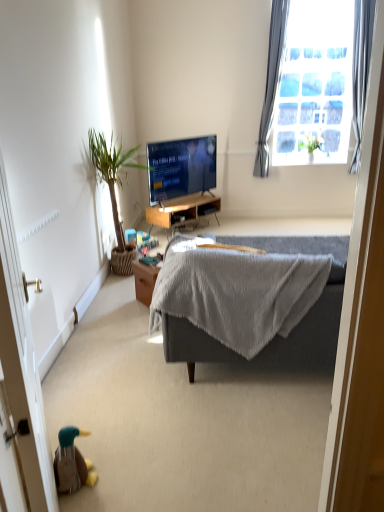
Question: Is wooden desk at center next to green leafy plant at left, placed as the first houseplant when sorted from front to back, and touching it?

Choices:
 (A) no
 (B) yes

Answer: (A)

Question: Can we say wooden desk at center lies outside green leafy plant at left, which is the 2th houseplant from top to bottom?

Choices:
 (A) no
 (B) yes

Answer: (B)

Question: Considering the relative sizes of wooden desk at center and green leafy plant at left, placed as the first houseplant when sorted from front to back, in the image provided, is wooden desk at center thinner than green leafy plant at left, placed as the first houseplant when sorted from front to back,?

Choices:
 (A) yes
 (B) no

Answer: (A)

Question: Does wooden desk at center have a lesser height compared to green leafy plant at left, the 1th houseplant viewed from the left?

Choices:
 (A) yes
 (B) no

Answer: (A)

Question: Considering the relative sizes of wooden desk at center and green leafy plant at left, arranged as the second houseplant when viewed from the back, in the image provided, is wooden desk at center bigger than green leafy plant at left, arranged as the second houseplant when viewed from the back,?

Choices:
 (A) yes
 (B) no

Answer: (B)

Question: From a real-world perspective, is wooden desk at center physically located above or below green leafy plant at left, arranged as the second houseplant when viewed from the back?

Choices:
 (A) above
 (B) below

Answer: (B)

Question: From their relative heights in the image, would you say wooden desk at center is taller or shorter than green leafy plant at left, the 1th houseplant viewed from the left?

Choices:
 (A) tall
 (B) short

Answer: (B)

Question: Looking at the image, does wooden desk at center seem bigger or smaller compared to green leafy plant at left, arranged as the second houseplant when viewed from the back?

Choices:
 (A) small
 (B) big

Answer: (A)

Question: Based on their positions, is wooden desk at center located to the left or right of green leafy plant at left, arranged as the second houseplant when viewed from the back?

Choices:
 (A) left
 (B) right

Answer: (B)

Question: From the image's perspective, is green leafy plant at upper right, which is the second houseplant from front to back, positioned above or below brown wooden screen door at lower left?

Choices:
 (A) above
 (B) below

Answer: (A)

Question: In terms of width, does green leafy plant at upper right, positioned as the 1th houseplant in top-to-bottom order, look wider or thinner when compared to brown wooden screen door at lower left?

Choices:
 (A) wide
 (B) thin

Answer: (A)

Question: Relative to brown wooden screen door at lower left, is green leafy plant at upper right, positioned as the 2th houseplant in left-to-right order, in front or behind?

Choices:
 (A) front
 (B) behind

Answer: (B)

Question: Is green leafy plant at upper right, the first houseplant viewed from the back, bigger or smaller than brown wooden screen door at lower left?

Choices:
 (A) small
 (B) big

Answer: (A)

Question: In terms of height, does gray fabric couch at center look taller or shorter compared to brown wooden screen door at lower left?

Choices:
 (A) tall
 (B) short

Answer: (B)

Question: Considering the positions of point (339, 251) and point (26, 486), is point (339, 251) closer or farther from the camera than point (26, 486)?

Choices:
 (A) closer
 (B) farther

Answer: (B)